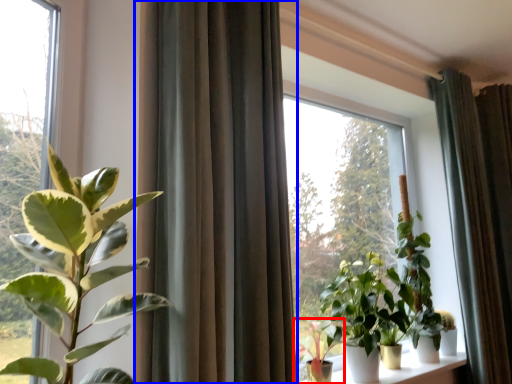
Question: Which point is closer to the camera, houseplant (highlighted by a red box) or curtain (highlighted by a blue box)?

Choices:
 (A) houseplant
 (B) curtain

Answer: (B)